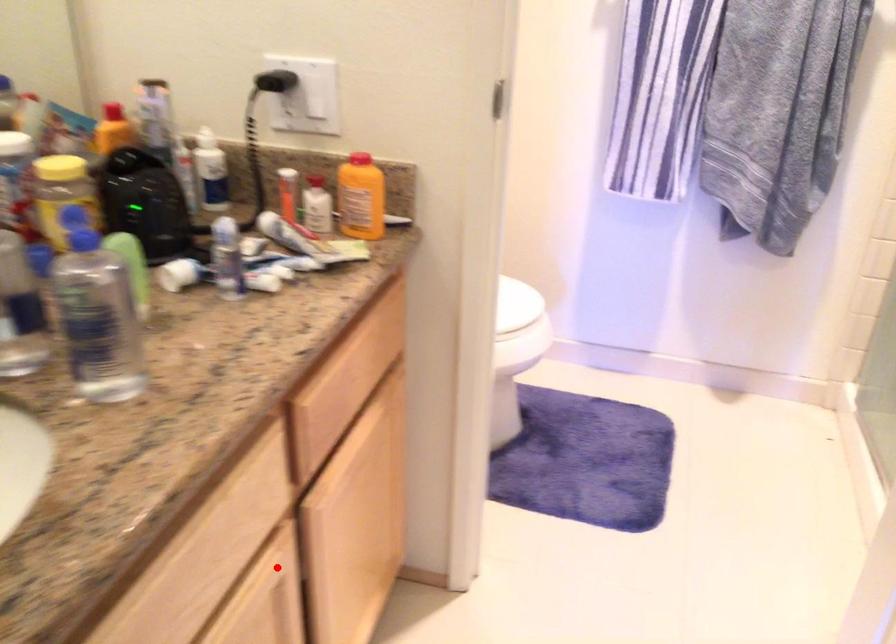
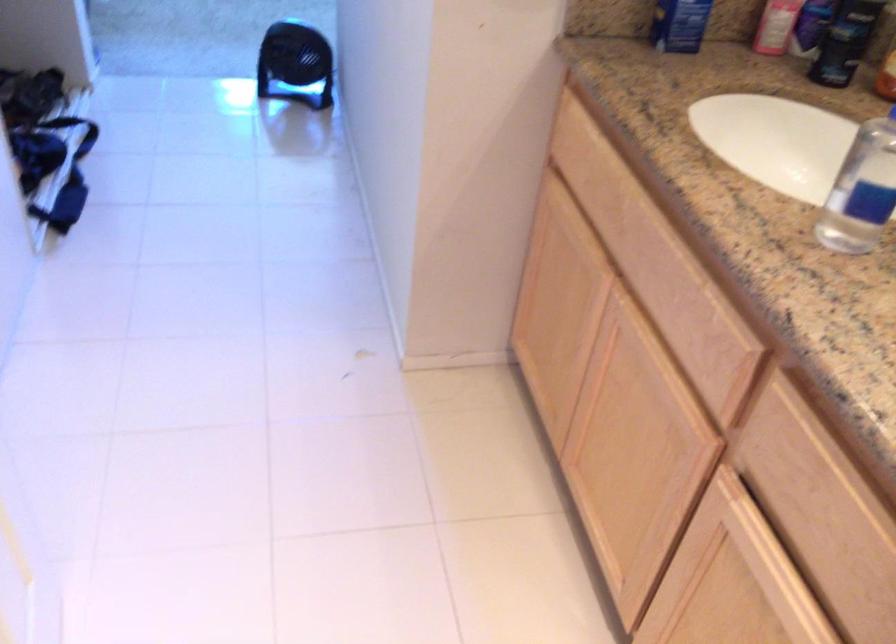
Find the pixel in the second image that matches the highlighted location in the first image.

(684, 429)